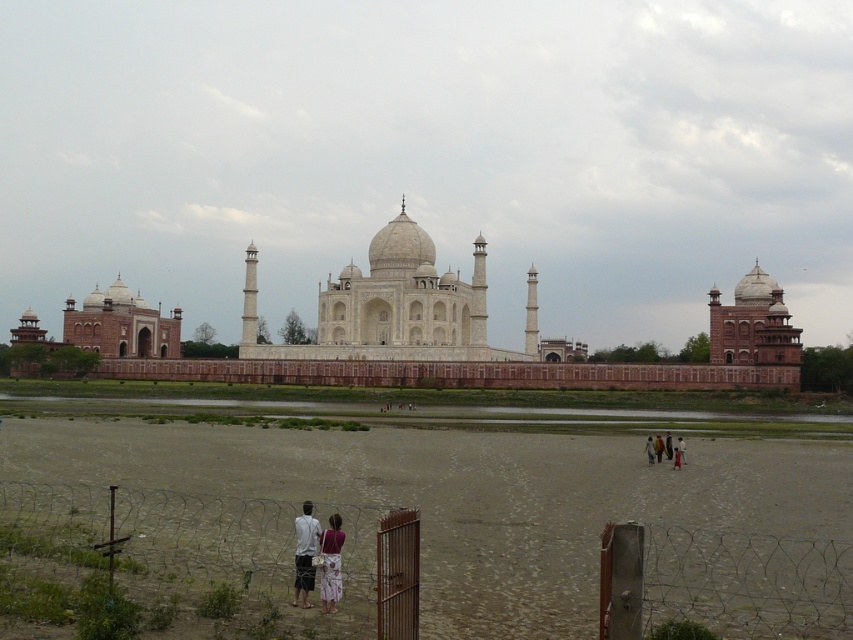
Between white marble palace at center and white marble palace at left, which one is positioned higher?

white marble palace at center is higher up.

Who is more forward, (383, 232) or (24, 339)?

Point (383, 232)

Where is `white marble palace at center`? white marble palace at center is located at coordinates (397, 307).

Looking at this image, does white marble palace at left appear over pink fabric dress at lower right?

Yes, white marble palace at left is above pink fabric dress at lower right.

Is white marble palace at left to the left of pink fabric dress at lower right from the viewer's perspective?

Indeed, white marble palace at left is positioned on the left side of pink fabric dress at lower right.

Describe the element at coordinates (109, 324) in the screenshot. I see `white marble palace at left` at that location.

The width and height of the screenshot is (853, 640). Find the location of `white marble palace at left`. white marble palace at left is located at coordinates (109, 324).

Looking at this image, is the position of white marble palace at left less distant than that of matte white dress at center?

No.

Is white marble palace at left positioned at the back of matte white dress at center?

Yes, white marble palace at left is further from the viewer.

Who is more forward, (142,330) or (328,584)?

Point (328,584) is more forward.

Where is `white marble palace at left`? The width and height of the screenshot is (853, 640). white marble palace at left is located at coordinates (109, 324).